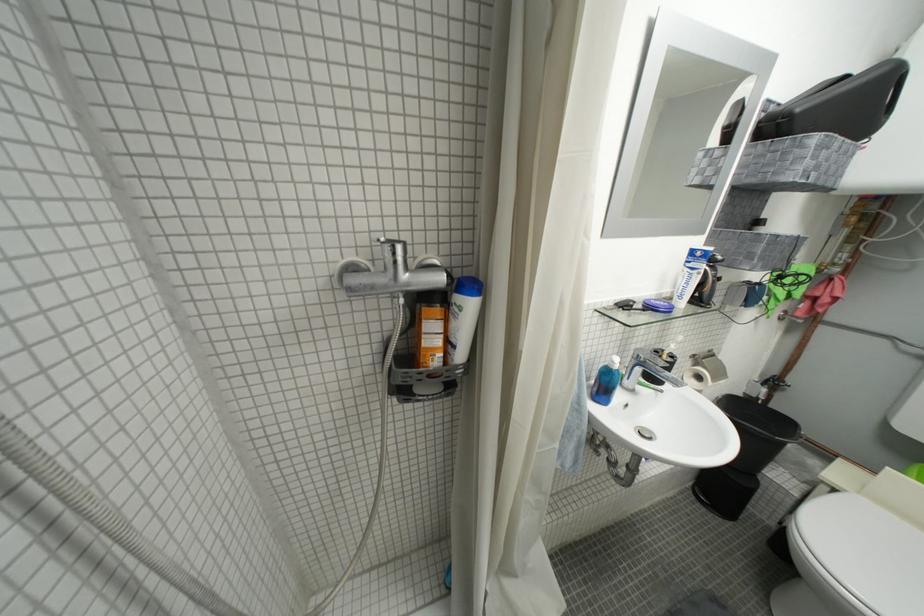
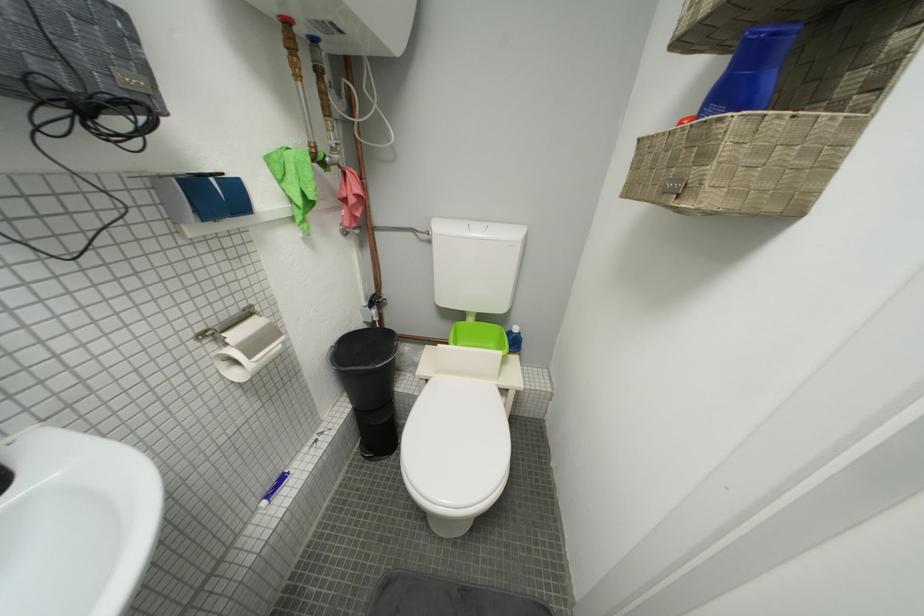
The first image is from the beginning of the video and the second image is from the end. How did the camera likely rotate when shooting the video?

The camera rotated toward right-down.